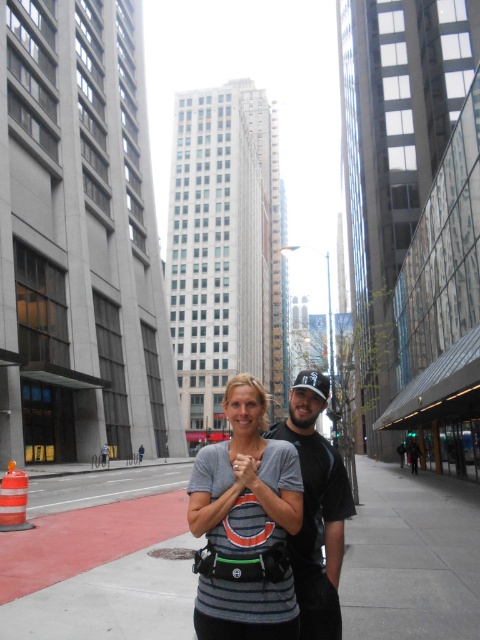
Question: Which point appears farthest from the camera in this image?

Choices:
 (A) (251, 586)
 (B) (255, 488)
 (C) (320, 534)

Answer: (C)

Question: Among these points, which one is nearest to the camera?

Choices:
 (A) (301, 593)
 (B) (240, 609)
 (C) (442, 547)
 (D) (249, 477)

Answer: (B)

Question: Does gray striped shirt at center have a greater width compared to smooth skin hand at center?

Choices:
 (A) no
 (B) yes

Answer: (B)

Question: Can you confirm if gray concrete sidewalk at center is thinner than gray striped shirt at center?

Choices:
 (A) yes
 (B) no

Answer: (B)

Question: Can you confirm if gray concrete sidewalk at center is thinner than dark gray fabric shirt at center?

Choices:
 (A) no
 (B) yes

Answer: (A)

Question: Which of the following is the farthest from the observer?

Choices:
 (A) smooth skin hand at center
 (B) gray concrete sidewalk at center
 (C) gray striped shirt at center

Answer: (B)